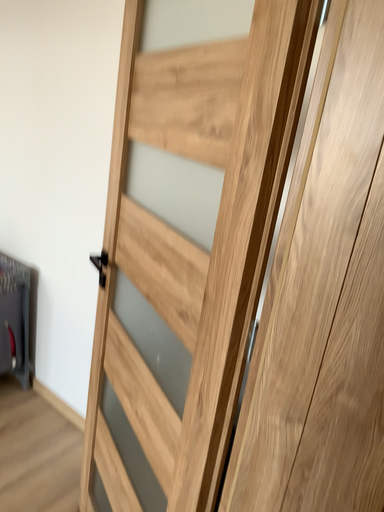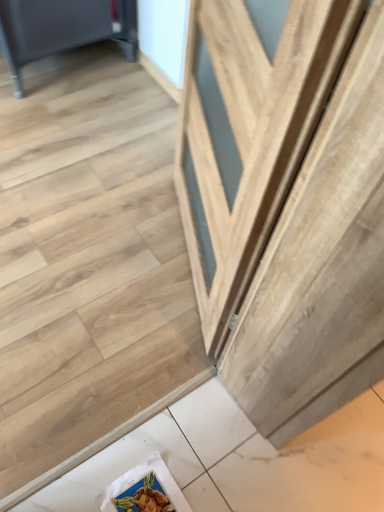
Question: How did the camera likely rotate when shooting the video?

Choices:
 (A) rotated right
 (B) rotated left

Answer: (B)